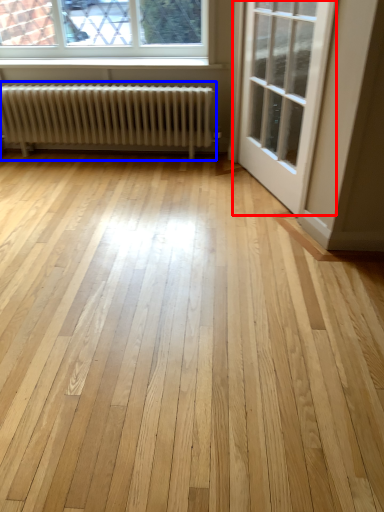
Question: Which of the following is the closest to the observer, door (highlighted by a red box) or radiator (highlighted by a blue box)?

Choices:
 (A) door
 (B) radiator

Answer: (A)